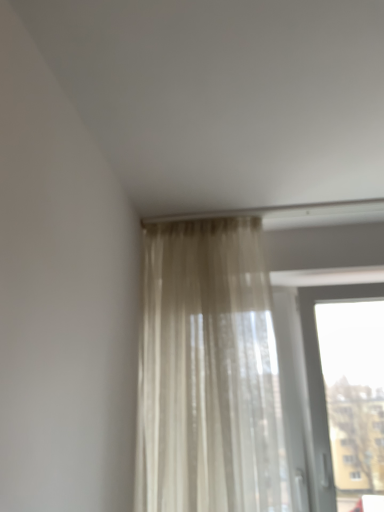
Question: Is transparent glass window at upper right positioned far away from sheer beige curtain at upper center?

Choices:
 (A) yes
 (B) no

Answer: (B)

Question: Is transparent glass window at upper right bigger than sheer beige curtain at upper center?

Choices:
 (A) no
 (B) yes

Answer: (A)

Question: Does transparent glass window at upper right lie behind sheer beige curtain at upper center?

Choices:
 (A) yes
 (B) no

Answer: (A)

Question: From a real-world perspective, is transparent glass window at upper right located higher than sheer beige curtain at upper center?

Choices:
 (A) no
 (B) yes

Answer: (A)

Question: Is transparent glass window at upper right at the left side of sheer beige curtain at upper center?

Choices:
 (A) no
 (B) yes

Answer: (A)

Question: From the image's perspective, is transparent glass window at upper right on sheer beige curtain at upper center?

Choices:
 (A) yes
 (B) no

Answer: (B)

Question: Is sheer beige curtain at upper center facing away from transparent glass window at upper right?

Choices:
 (A) yes
 (B) no

Answer: (B)

Question: Could you tell me if sheer beige curtain at upper center is facing transparent glass window at upper right?

Choices:
 (A) no
 (B) yes

Answer: (A)

Question: From a real-world perspective, is sheer beige curtain at upper center on transparent glass window at upper right?

Choices:
 (A) no
 (B) yes

Answer: (B)

Question: From the image's perspective, does sheer beige curtain at upper center appear higher than transparent glass window at upper right?

Choices:
 (A) no
 (B) yes

Answer: (B)

Question: Can you confirm if sheer beige curtain at upper center is positioned to the right of transparent glass window at upper right?

Choices:
 (A) no
 (B) yes

Answer: (A)

Question: Does sheer beige curtain at upper center contain transparent glass window at upper right?

Choices:
 (A) yes
 (B) no

Answer: (B)

Question: From a real-world perspective, is sheer beige curtain at upper center physically located above or below transparent glass window at upper right?

Choices:
 (A) below
 (B) above

Answer: (B)